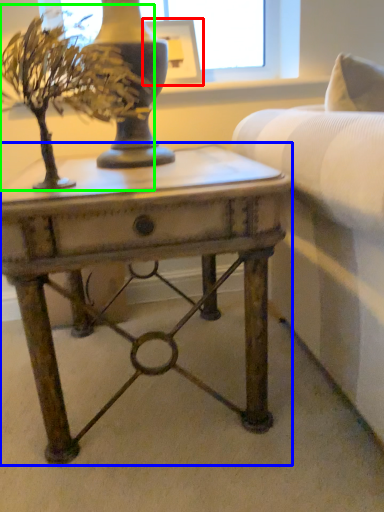
Question: Which is nearer to the picture frame (highlighted by a red box)? table (highlighted by a blue box) or houseplant (highlighted by a green box).

Choices:
 (A) table
 (B) houseplant

Answer: (B)